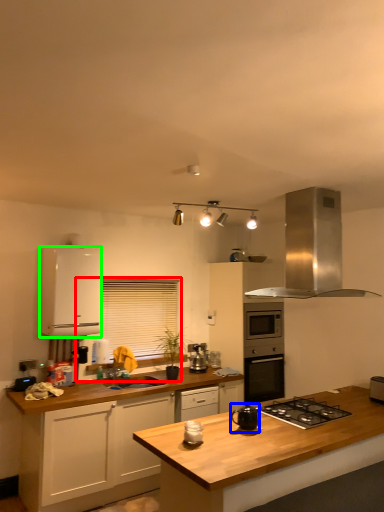
Question: Estimate the real-world distances between objects in this image. Which object is closer to window screen (highlighted by a red box), kitchen appliance (highlighted by a blue box) or cabinetry (highlighted by a green box)?

Choices:
 (A) kitchen appliance
 (B) cabinetry

Answer: (B)